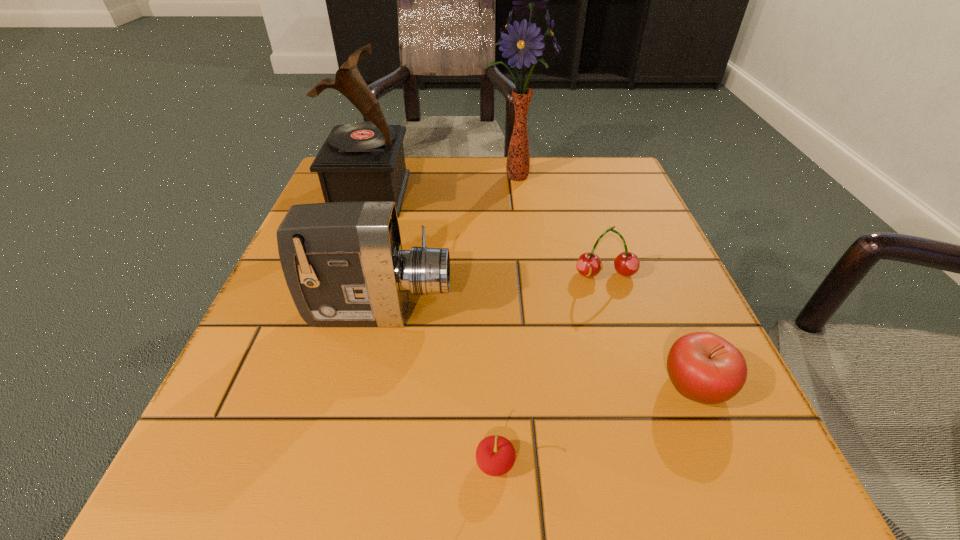
Image resolution: width=960 pixels, height=540 pixels. I want to click on vacant space situated 0.050m at the horn opening of the phonograph_record, so click(428, 194).

Where is `blank space located at the front of the camcorder, highlighting the lens`? This screenshot has width=960, height=540. blank space located at the front of the camcorder, highlighting the lens is located at coordinates (629, 312).

Locate an element on the screen. The height and width of the screenshot is (540, 960). free location located with stems pointing upwards on the farther cherry is located at coordinates (680, 509).

Locate an element on the screen. Image resolution: width=960 pixels, height=540 pixels. vacant area located on the front of the second nearest object is located at coordinates coord(731,470).

This screenshot has height=540, width=960. What are the coordinates of `vacant space situated 0.310m on the left of the left cherry` in the screenshot? It's located at (218, 464).

Identify the location of flower arrangement positioned at the far edge. (524, 43).

Find the location of a particular element. The image size is (960, 540). phonograph_record present at the far edge is located at coordinates (359, 162).

Find the location of a particular element. object that is at the near edge is located at coordinates (495, 455).

You are a GUI agent. You are given a task and a screenshot of the screen. Output one action in this format:
    pyautogui.click(x=<x>, y=<y>)
    Task: Click on the phonograph_record that is at the left edge
    Image resolution: width=960 pixels, height=540 pixels.
    Given the screenshot: What is the action you would take?
    pyautogui.click(x=359, y=162)

I want to click on camcorder that is at the left edge, so click(343, 262).